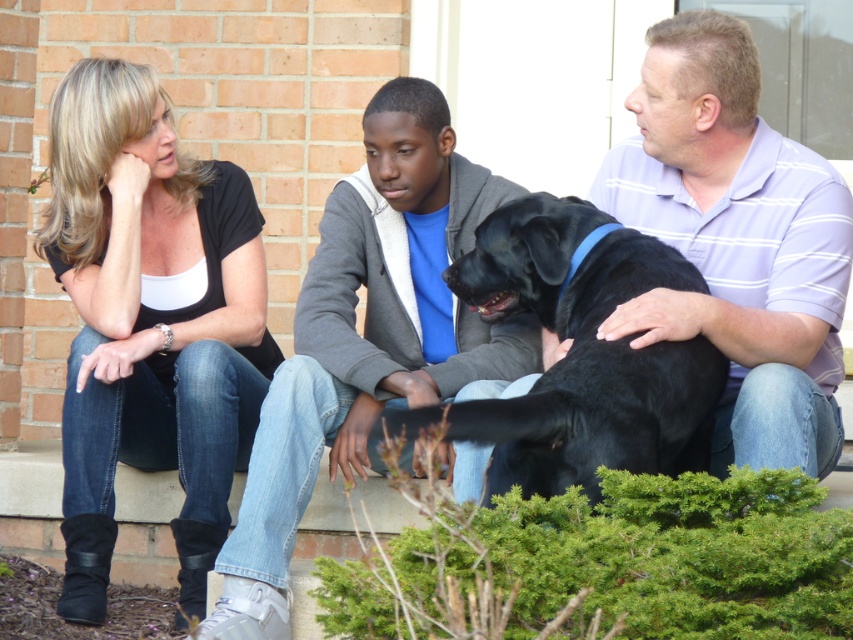
You are a photographer trying to capture a candid shot of the matte purple shirt at center and the black smooth dog at center. Can you fit both subjects into a camera frame that has a maximum width of 12 inches between them?

The matte purple shirt at center and the black smooth dog at center are 11.98 inches apart from each other, so yes, they can both fit into the camera frame since the distance between them is slightly less than the 12 inch maximum width.

In the scene shown: Based on the scene description, which object is taller between the matte purple shirt at center and the black smooth dog at center?

The matte purple shirt at center is taller than the black smooth dog at center.